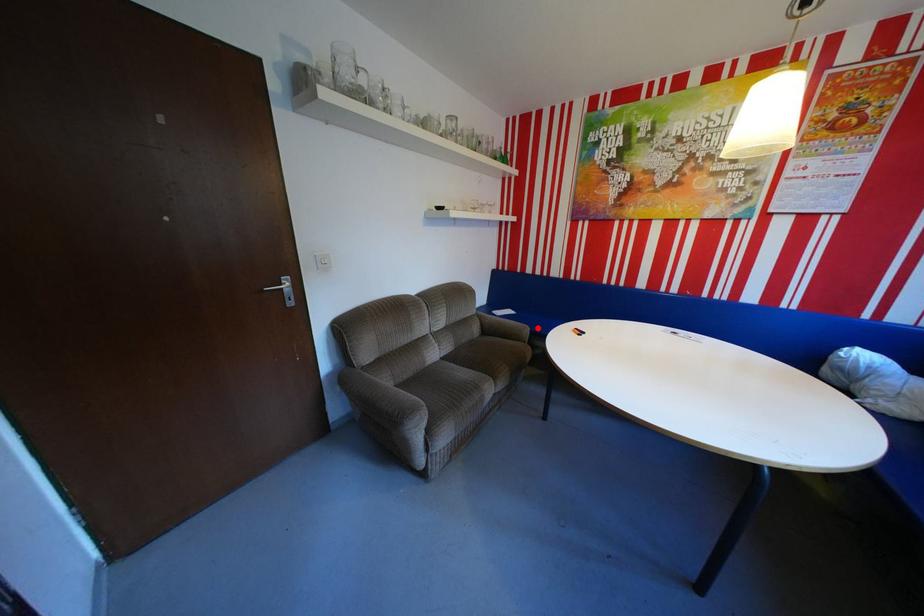
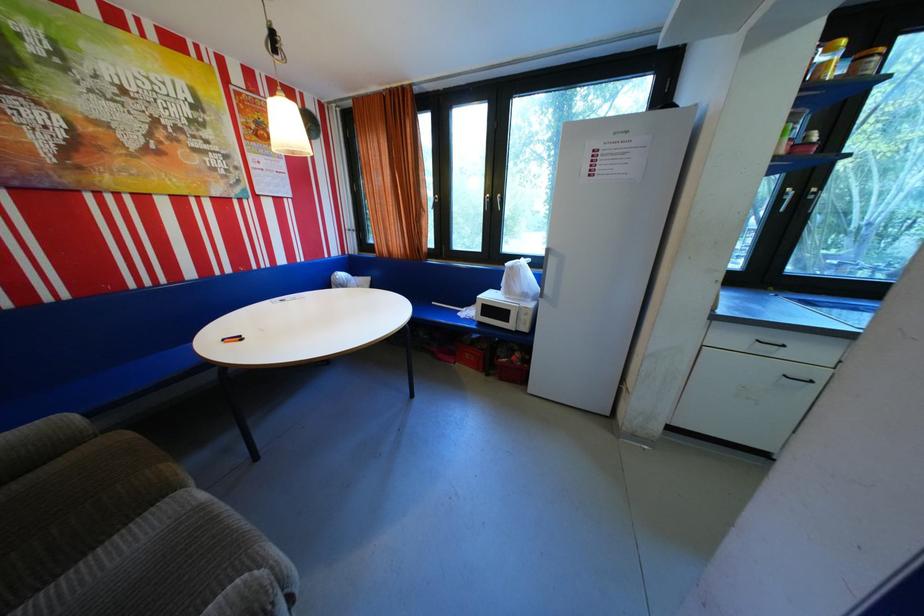
The point at the highlighted location is marked in the first image. Where is the corresponding point in the second image?

(79, 418)